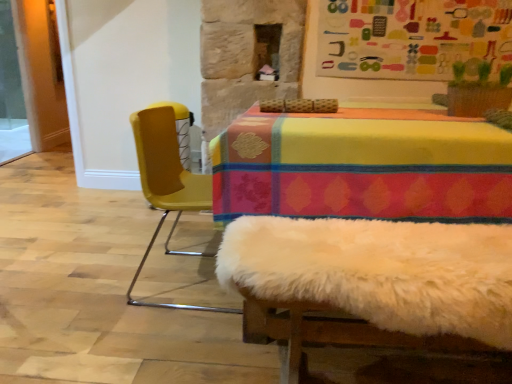
Question: Is multicolored fabric bulletin board at upper center turned away from transparent glass screen door at left?

Choices:
 (A) yes
 (B) no

Answer: (B)

Question: Is multicolored fabric bulletin board at upper center thinner than transparent glass screen door at left?

Choices:
 (A) yes
 (B) no

Answer: (A)

Question: Can you confirm if multicolored fabric bulletin board at upper center is smaller than transparent glass screen door at left?

Choices:
 (A) yes
 (B) no

Answer: (A)

Question: Would you say transparent glass screen door at left is part of multicolored fabric bulletin board at upper center's contents?

Choices:
 (A) no
 (B) yes

Answer: (A)

Question: Is multicolored fabric bulletin board at upper center bigger than transparent glass screen door at left?

Choices:
 (A) no
 (B) yes

Answer: (A)

Question: From a real-world perspective, is yellow plastic chair at left physically located above or below transparent glass screen door at left?

Choices:
 (A) below
 (B) above

Answer: (A)

Question: Does point (198, 180) appear closer or farther from the camera than point (5, 147)?

Choices:
 (A) closer
 (B) farther

Answer: (A)

Question: Relative to transparent glass screen door at left, is yellow plastic chair at left in front or behind?

Choices:
 (A) front
 (B) behind

Answer: (A)

Question: In terms of size, does yellow plastic chair at left appear bigger or smaller than transparent glass screen door at left?

Choices:
 (A) big
 (B) small

Answer: (A)

Question: From their relative heights in the image, would you say multicolored fabric bulletin board at upper center is taller or shorter than yellow plastic chair at left?

Choices:
 (A) tall
 (B) short

Answer: (B)

Question: Would you say multicolored fabric bulletin board at upper center is to the left or to the right of yellow plastic chair at left in the picture?

Choices:
 (A) left
 (B) right

Answer: (B)

Question: From the image's perspective, relative to yellow plastic chair at left, is multicolored fabric bulletin board at upper center above or below?

Choices:
 (A) above
 (B) below

Answer: (A)

Question: Is point (384, 48) closer or farther from the camera than point (150, 124)?

Choices:
 (A) closer
 (B) farther

Answer: (B)

Question: In the image, is transparent glass screen door at left on the left side or the right side of yellow plastic chair at left?

Choices:
 (A) left
 (B) right

Answer: (A)

Question: Is point (3, 64) closer or farther from the camera than point (180, 253)?

Choices:
 (A) farther
 (B) closer

Answer: (A)